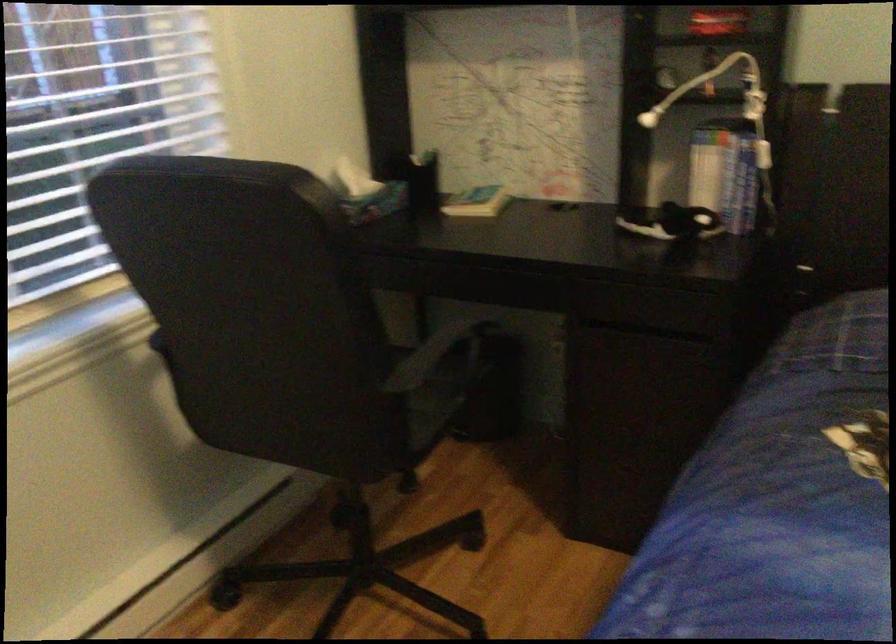
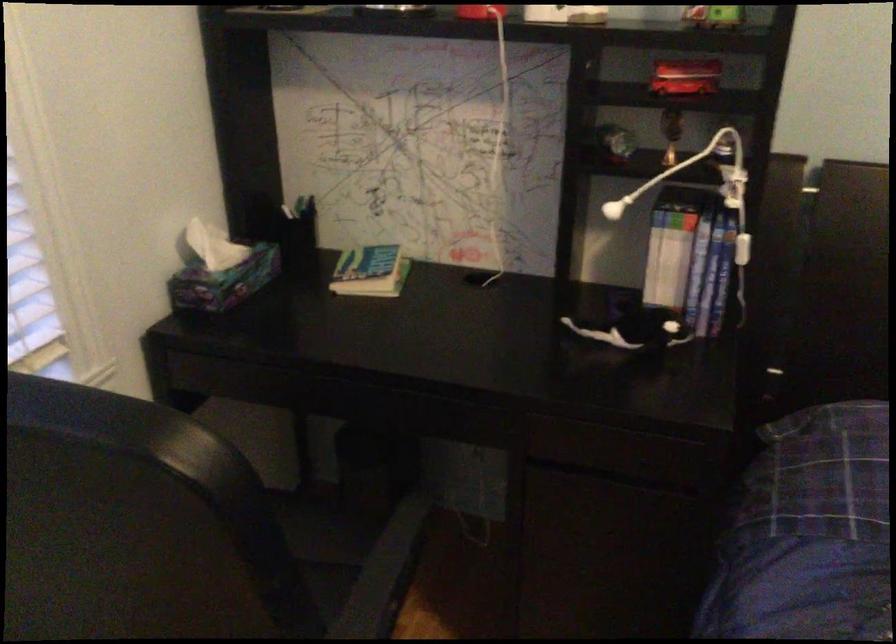
The point at (741, 191) is marked in the first image. Where is the corresponding point in the second image?

(707, 288)